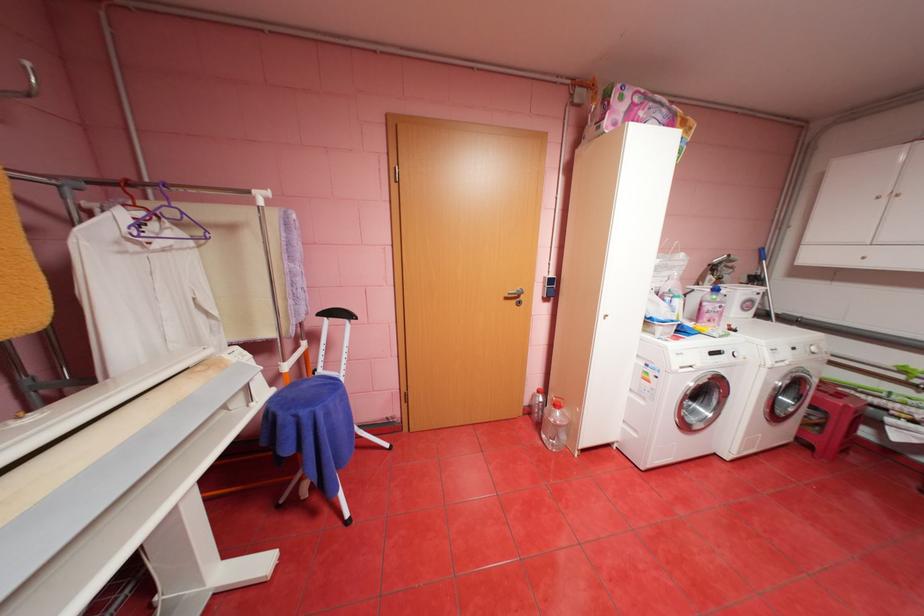
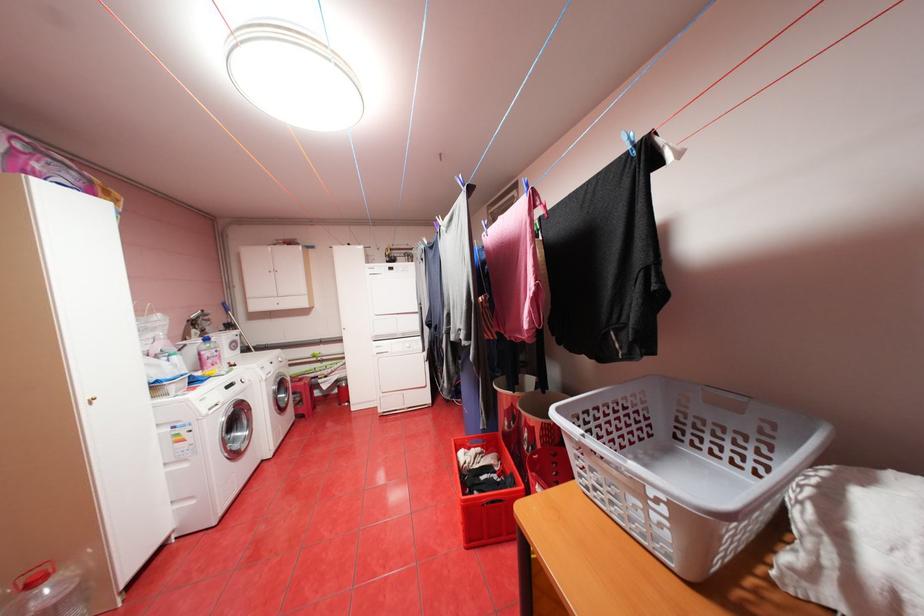
Question: The images are taken continuously from a first-person perspective. In which direction is your viewpoint rotating?

Choices:
 (A) Left
 (B) Right
 (C) Up
 (D) Down

Answer: (B)